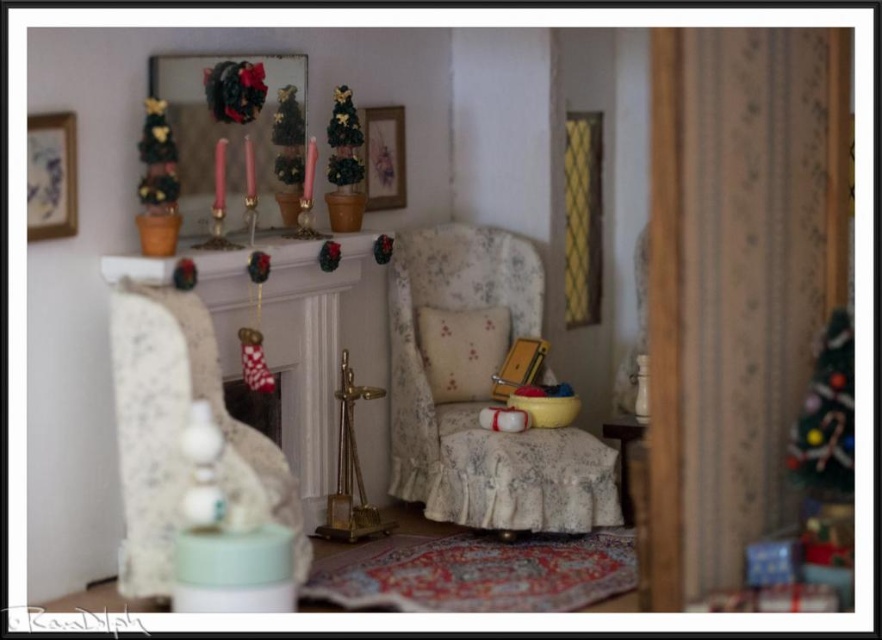
Between blue paper picture frame at upper left and matte gold picture frame at upper center, which one has more height?

With more height is matte gold picture frame at upper center.

Locate an element on the screen. The image size is (882, 640). blue paper picture frame at upper left is located at coordinates (51, 176).

Image resolution: width=882 pixels, height=640 pixels. What are the coordinates of `blue paper picture frame at upper left` in the screenshot? It's located at (51, 176).

Between point (821, 369) and point (36, 144), which one is positioned behind?

The point (36, 144) is behind.

Does green felt christmas tree at right have a greater width compared to blue paper picture frame at upper left?

Indeed, green felt christmas tree at right has a greater width compared to blue paper picture frame at upper left.

The image size is (882, 640). Describe the element at coordinates (826, 416) in the screenshot. I see `green felt christmas tree at right` at that location.

This screenshot has width=882, height=640. In order to click on green felt christmas tree at right in this screenshot , I will do `click(826, 416)`.

Who is more forward, (x=596, y=472) or (x=363, y=483)?

Positioned in front is point (x=596, y=472).

Is point (573, 445) positioned behind point (338, 515)?

No, (573, 445) is closer to viewer.

What do you see at coordinates (522, 480) in the screenshot?
I see `floral fabric stool at center` at bounding box center [522, 480].

This screenshot has width=882, height=640. I want to click on floral fabric stool at center, so click(522, 480).